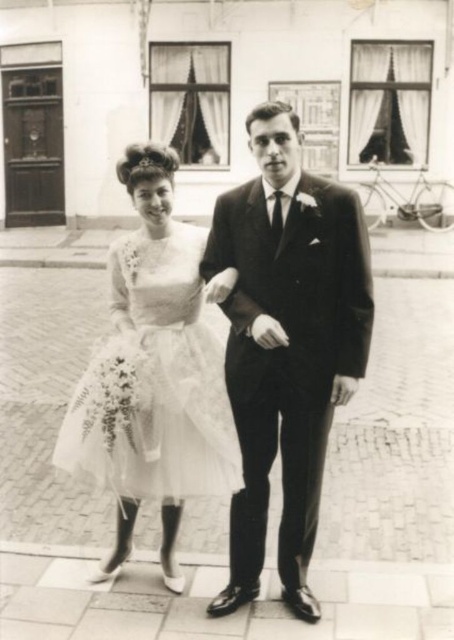
Question: Can you confirm if smooth black suit at center is positioned above matte white tulle dress at center?

Choices:
 (A) yes
 (B) no

Answer: (B)

Question: Among these points, which one is farthest from the camera?

Choices:
 (A) (300, 570)
 (B) (63, 420)

Answer: (B)

Question: Is smooth black suit at center bigger than matte white tulle dress at center?

Choices:
 (A) yes
 (B) no

Answer: (A)

Question: Which point is farther to the camera?

Choices:
 (A) matte white tulle dress at center
 (B) smooth black suit at center

Answer: (A)

Question: Does smooth black suit at center have a smaller size compared to matte white tulle dress at center?

Choices:
 (A) no
 (B) yes

Answer: (A)